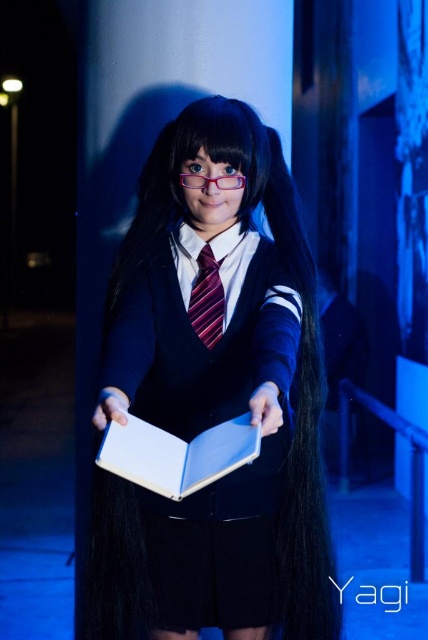
You are a photographer adjusting your camera settings to focus on the matte black uniform at center and the striped silk tie at center. Which object should you focus on first to ensure both are in sharp focus?

The matte black uniform at center is in front of the striped silk tie at center, so you should focus on the matte black uniform at center first to ensure both are in sharp focus.

You are a photographer trying to capture a closeup of the white matte book at center while ensuring the matte black uniform at center is still visible in the frame. Given that your camera has a minimum focus distance of 8 inches, will you be able to achieve this shot?

The matte black uniform at center and white matte book at center are 8.93 inches apart. Since the minimum focus distance is 8 inches, the photographer can achieve the closeup shot while keeping both objects in the frame as the distance is sufficient.

You are a photographer adjusting your camera settings to capture the scene. The white matte book at center and the striped silk tie at center are both in focus. If you want to ensure the wider object between them is properly lit, which one should you adjust the lighting for?

The white matte book at center is wider than the striped silk tie at center, so you should adjust the lighting for the white matte book at center to ensure proper illumination.